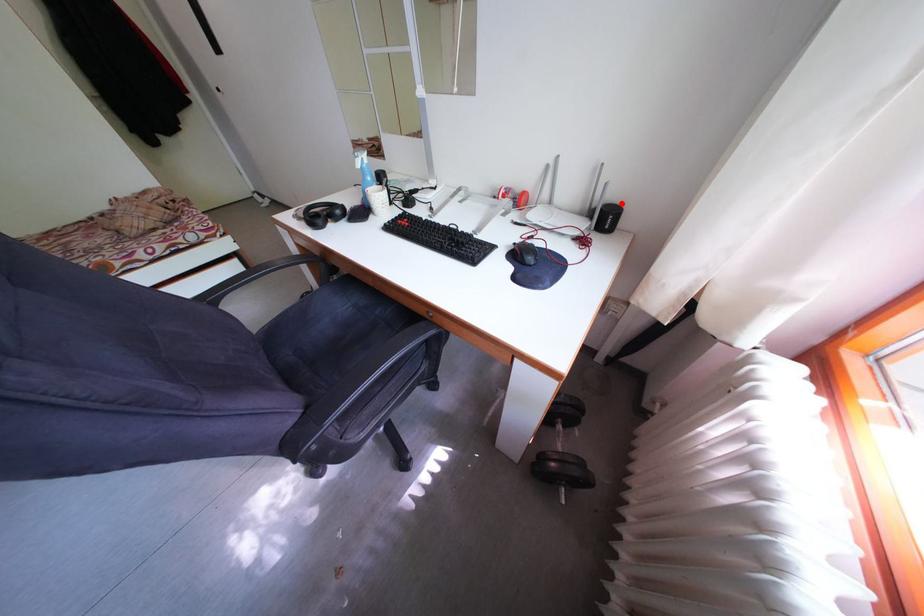
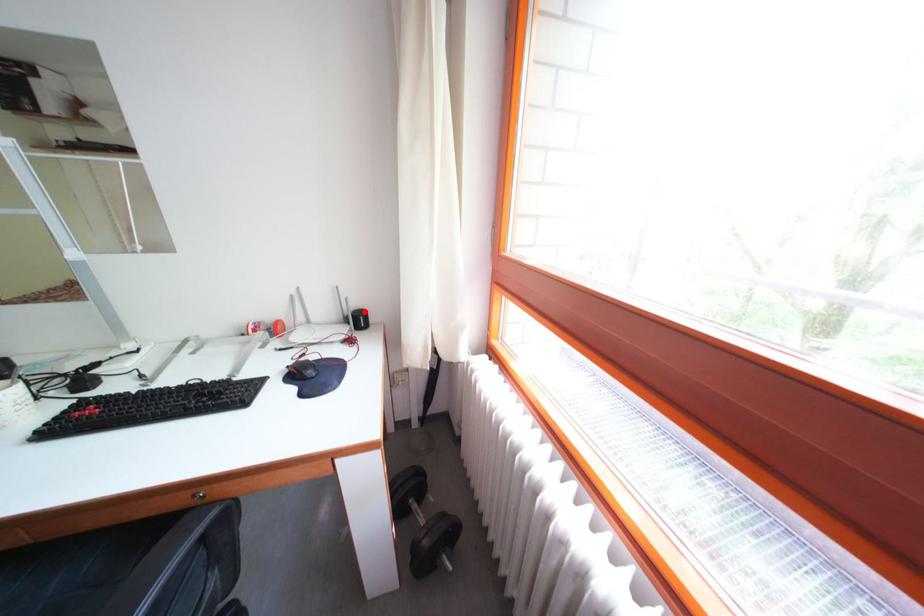
I am providing you with two images of the same scene from different viewpoints. A red point is marked on the first image and another point is marked on the second image. Does the point marked in image1 correspond to the same location as the one in image2?

Yes